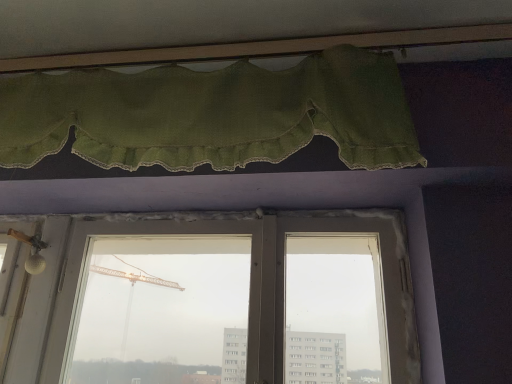
Question: Is green fabric curtain at upper center far from transparent glass window at center?

Choices:
 (A) yes
 (B) no

Answer: (B)

Question: Could you tell me if green fabric curtain at upper center is turned towards transparent glass window at center?

Choices:
 (A) no
 (B) yes

Answer: (A)

Question: Is green fabric curtain at upper center closer to the viewer compared to transparent glass window at center?

Choices:
 (A) yes
 (B) no

Answer: (A)

Question: Does green fabric curtain at upper center have a larger size compared to transparent glass window at center?

Choices:
 (A) yes
 (B) no

Answer: (A)

Question: Is green fabric curtain at upper center with transparent glass window at center?

Choices:
 (A) no
 (B) yes

Answer: (A)

Question: Is green fabric curtain at upper center not inside transparent glass window at center?

Choices:
 (A) no
 (B) yes

Answer: (B)

Question: Can you confirm if transparent glass window at center is positioned to the right of green fabric curtain at upper center?

Choices:
 (A) yes
 (B) no

Answer: (A)

Question: Is transparent glass window at center further to the viewer compared to green fabric curtain at upper center?

Choices:
 (A) yes
 (B) no

Answer: (A)

Question: Could you tell me if transparent glass window at center is turned towards green fabric curtain at upper center?

Choices:
 (A) yes
 (B) no

Answer: (B)

Question: Is transparent glass window at center directly adjacent to green fabric curtain at upper center?

Choices:
 (A) yes
 (B) no

Answer: (B)

Question: Can you confirm if transparent glass window at center is taller than green fabric curtain at upper center?

Choices:
 (A) no
 (B) yes

Answer: (B)

Question: Could green fabric curtain at upper center be considered to be inside transparent glass window at center?

Choices:
 (A) yes
 (B) no

Answer: (B)

Question: Choose the correct answer: Is transparent glass window at center inside green fabric curtain at upper center or outside it?

Choices:
 (A) inside
 (B) outside

Answer: (B)